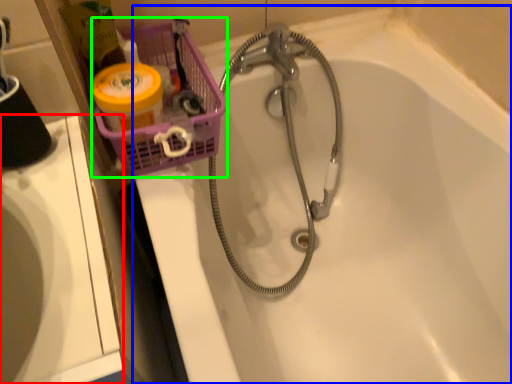
Question: Which object is positioned farthest from sink (highlighted by a red box)? Select from bathtub (highlighted by a blue box) and basket (highlighted by a green box).

Choices:
 (A) bathtub
 (B) basket

Answer: (A)